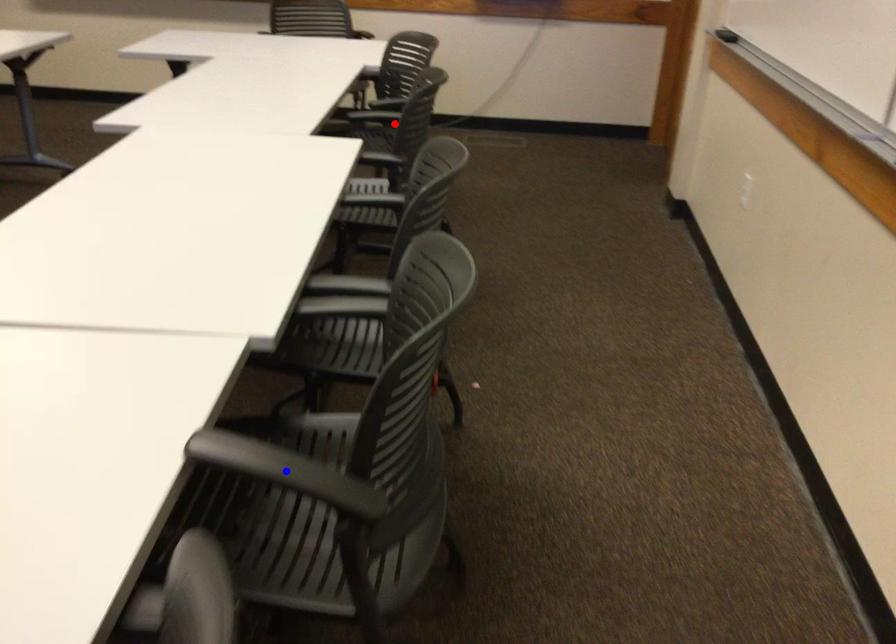
Question: In the image, two points are highlighted. Which point is nearer to the camera? Reply with the corresponding letter.

Choices:
 (A) blue point
 (B) red point

Answer: (A)